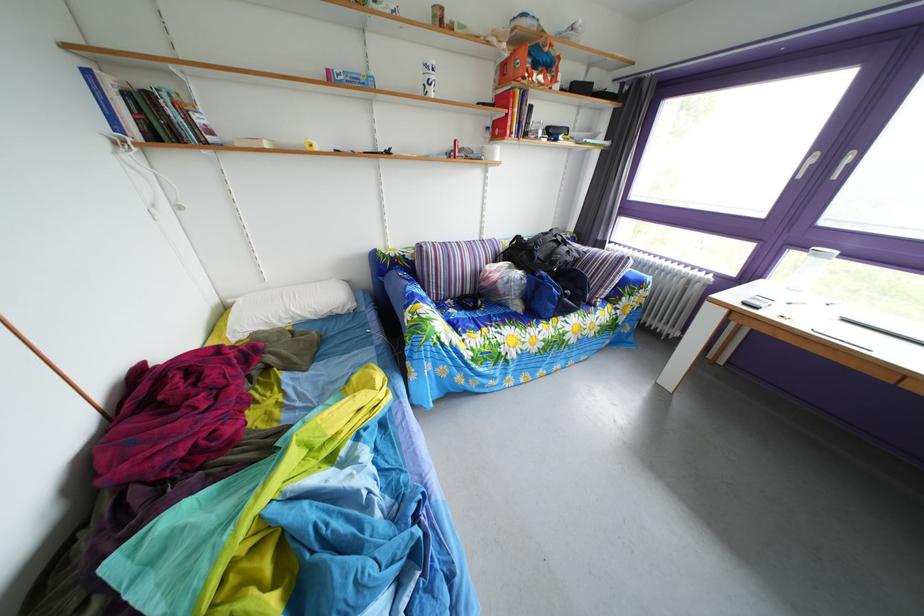
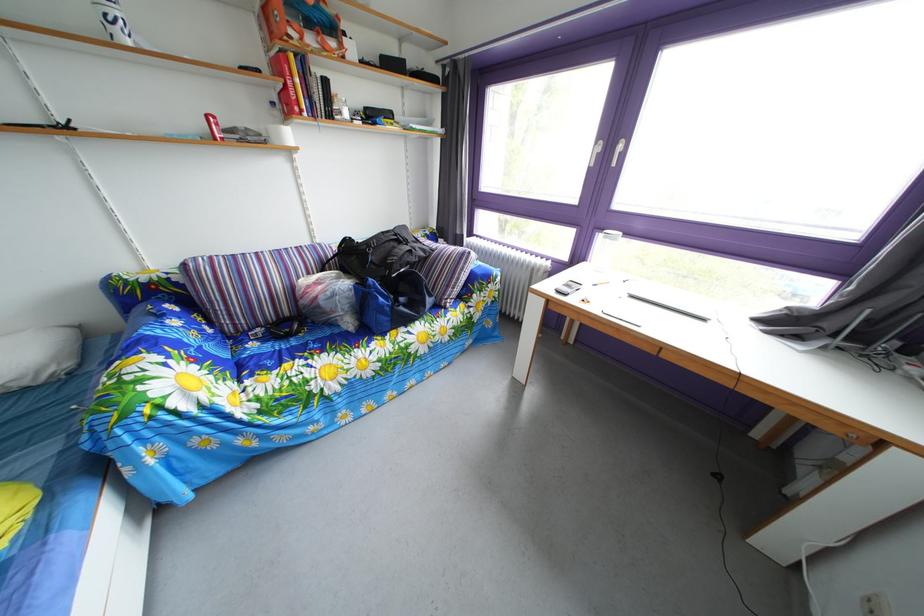
Question: In a continuous first-person perspective shot, in which direction is the camera moving?

Choices:
 (A) Left
 (B) Right
 (C) Forward
 (D) Backward

Answer: (B)